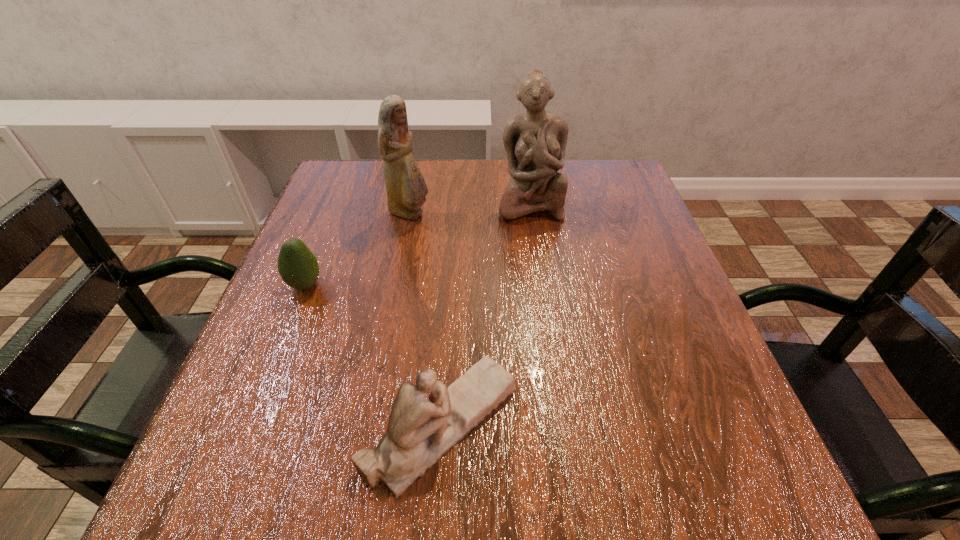
In the image, there is a desktop. Where is `free space at the left edge`? free space at the left edge is located at coordinates [349, 255].

Where is `vacant space at the right edge of the desktop`? vacant space at the right edge of the desktop is located at coordinates (646, 447).

In the image, there is a desktop. At what (x,y) coordinates should I click in order to perform the action: click on vacant space at the far left corner. Please return your answer as a coordinate pair (x, y). This screenshot has width=960, height=540. Looking at the image, I should click on (380, 168).

Find the location of a particular element. Image resolution: width=960 pixels, height=540 pixels. vacant region at the far right corner of the desktop is located at coordinates (636, 202).

The image size is (960, 540). In order to click on vacant space at the near right corner in this screenshot , I will do `click(688, 511)`.

The width and height of the screenshot is (960, 540). Identify the location of free spot between the shortest object and the nearest object. (373, 354).

At what (x,y) coordinates should I click in order to perform the action: click on object that is the third closest to the shortest object. Please return your answer as a coordinate pair (x, y). Image resolution: width=960 pixels, height=540 pixels. Looking at the image, I should click on (535, 142).

Identify which object is the third nearest to the second nearest object. Please provide its 2D coordinates. Your answer should be formatted as a tuple, i.e. [(x, y)], where the tuple contains the x and y coordinates of a point satisfying the conditions above.

[(535, 142)]

Locate which figurine is the closest to the avocado. Please provide its 2D coordinates. Your answer should be formatted as a tuple, i.e. [(x, y)], where the tuple contains the x and y coordinates of a point satisfying the conditions above.

[(406, 189)]

Image resolution: width=960 pixels, height=540 pixels. In order to click on the closest figurine to the second shortest object in this screenshot , I will do `click(406, 189)`.